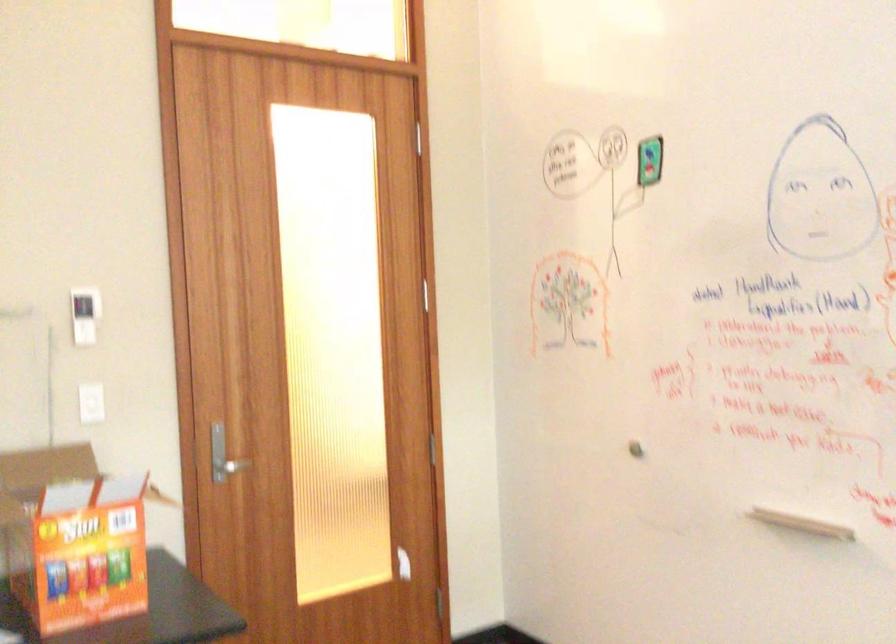
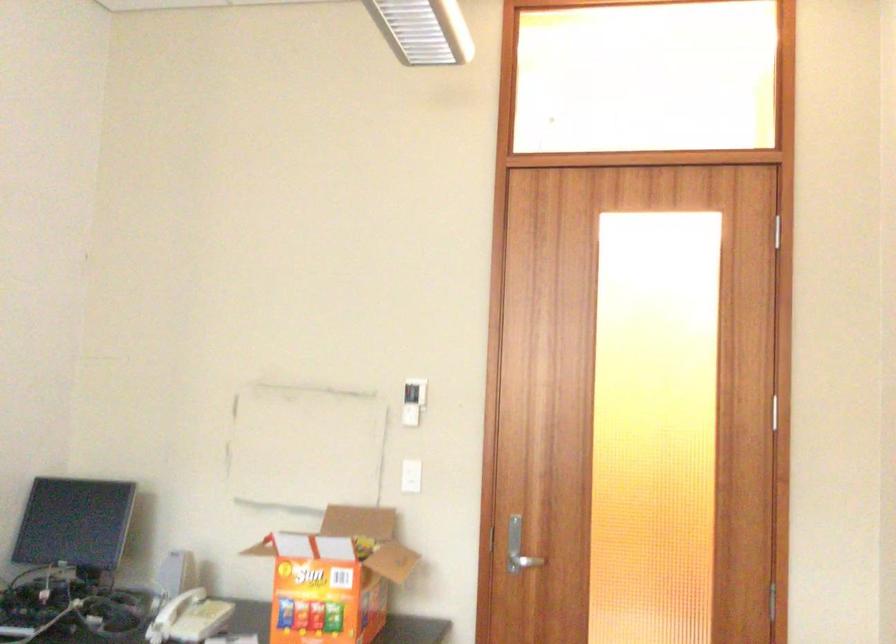
Where in the second image is the point corresponding to [233,465] from the first image?

(523, 562)